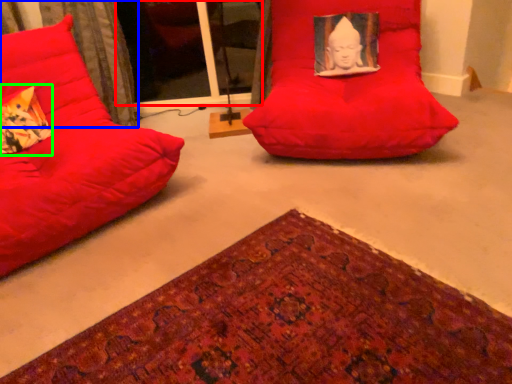
Question: Which object is positioned farthest from glass door (highlighted by a red box)? Select from curtain (highlighted by a blue box) and throw pillow (highlighted by a green box).

Choices:
 (A) curtain
 (B) throw pillow

Answer: (B)